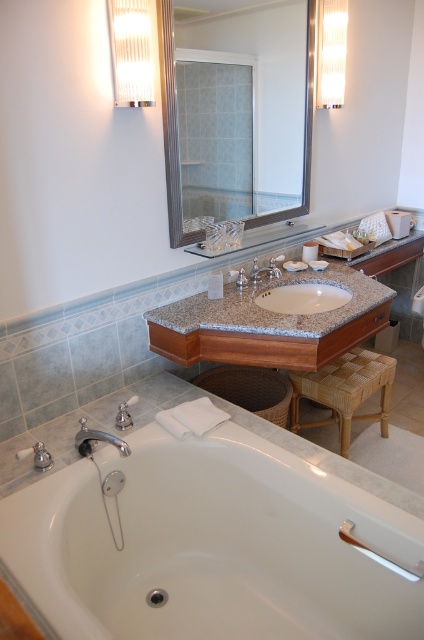
Based on the photo, is white glossy bathtub at lower left in front of silver metallic faucet at lower left?

That is True.

Which is behind, point (63, 536) or point (120, 445)?

The point (120, 445) is more distant.

Is point (58, 515) positioned before point (98, 429)?

Yes.

Where is `white glossy bathtub at lower left`? The width and height of the screenshot is (424, 640). white glossy bathtub at lower left is located at coordinates (212, 545).

Consider the image. Is white glossy bathtub at lower left smaller than clear glass mirror at upper center?

Incorrect, white glossy bathtub at lower left is not smaller in size than clear glass mirror at upper center.

Between white glossy bathtub at lower left and clear glass mirror at upper center, which one has less height?

With less height is white glossy bathtub at lower left.

What do you see at coordinates (212, 545) in the screenshot? I see `white glossy bathtub at lower left` at bounding box center [212, 545].

I want to click on white glossy bathtub at lower left, so click(212, 545).

Who is positioned more to the right, white glossy bathtub at lower left or beige marble sink at center?

beige marble sink at center is more to the right.

Between point (97, 548) and point (273, 291), which one is positioned in front?

Point (97, 548) is more forward.

Is point (334, 563) farther from viewer compared to point (286, 305)?

That is False.

Identify the location of white glossy bathtub at lower left. The height and width of the screenshot is (640, 424). tap(212, 545).